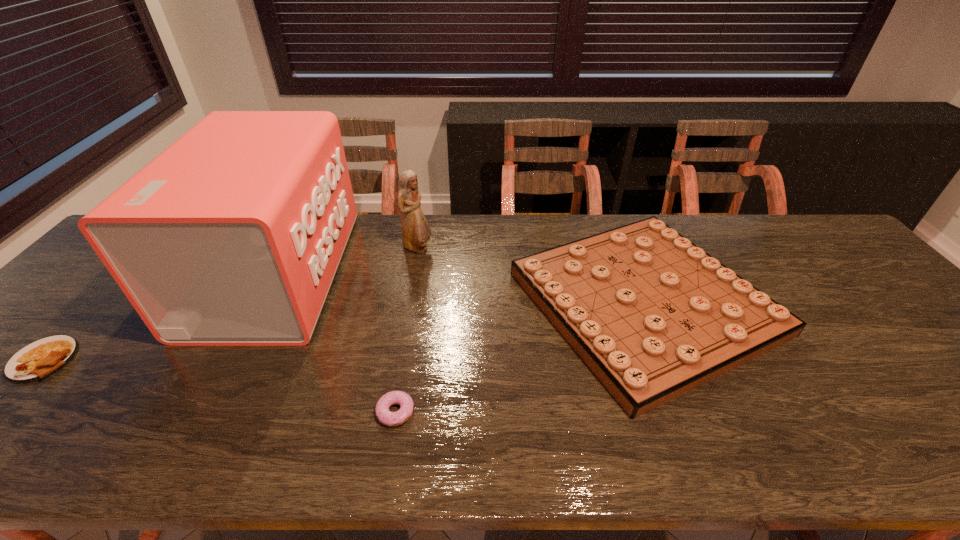
Where is `the fourth object from right to left`? the fourth object from right to left is located at coordinates (232, 236).

This screenshot has width=960, height=540. I want to click on the tallest object, so click(232, 236).

At what (x,y) coordinates should I click in order to perform the action: click on figurine. Please return your answer as a coordinate pair (x, y). Looking at the image, I should click on 416,232.

The image size is (960, 540). What are the coordinates of `gameboard` in the screenshot? It's located at (653, 316).

You are a GUI agent. You are given a task and a screenshot of the screen. Output one action in this format:
    pyautogui.click(x=<x>, y=<y>)
    Task: Click on the rightmost object
    
    Given the screenshot: What is the action you would take?
    pyautogui.click(x=653, y=316)

Locate an element on the screen. doughnut is located at coordinates (384, 415).

This screenshot has height=540, width=960. What are the coordinates of `vacant space situated 0.160m on the surface of the tallest object where the text is embossed` in the screenshot? It's located at (398, 273).

Image resolution: width=960 pixels, height=540 pixels. Identify the location of vacant position located on the front-facing side of the second tallest object. (508, 248).

I want to click on free space located 0.280m on the right of the rightmost object, so click(879, 303).

The width and height of the screenshot is (960, 540). Find the location of `blank space located 0.380m on the right of the doughnut`. blank space located 0.380m on the right of the doughnut is located at coordinates (595, 411).